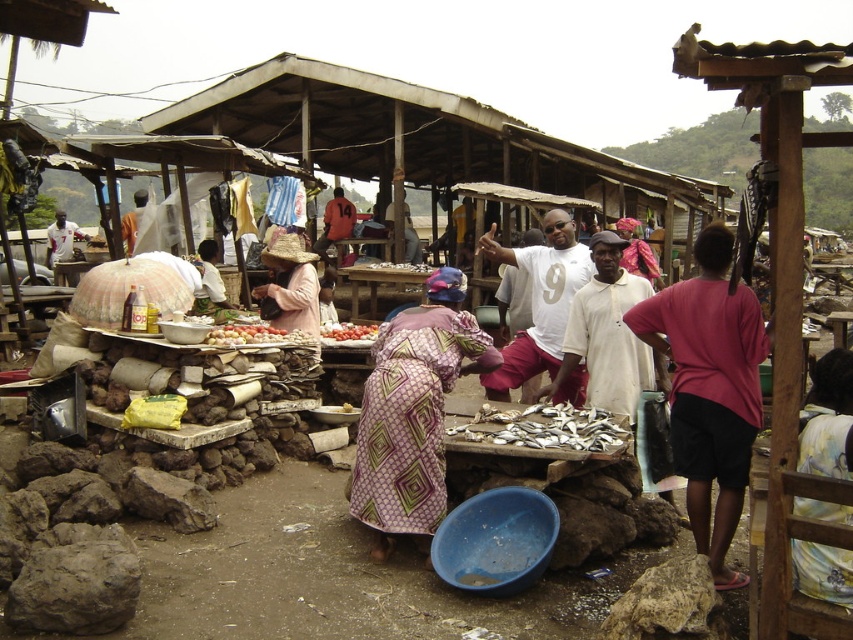
Who is taller, pink fabric shirt at right or purple printed fabric at center?

With more height is pink fabric shirt at right.

Between point (672, 300) and point (456, 294), which one is positioned in front?

Point (672, 300) is in front.

This screenshot has width=853, height=640. What do you see at coordinates (711, 388) in the screenshot?
I see `pink fabric shirt at right` at bounding box center [711, 388].

Locate an element on the screen. Image resolution: width=853 pixels, height=640 pixels. pink fabric shirt at right is located at coordinates (711, 388).

Based on the photo, is silver metallic fish at center shorter than smooth red tomatoes at center?

No.

Can you confirm if silver metallic fish at center is positioned above smooth red tomatoes at center?

Incorrect, silver metallic fish at center is not positioned above smooth red tomatoes at center.

Identify the location of silver metallic fish at center. Image resolution: width=853 pixels, height=640 pixels. (546, 428).

Does purple printed fabric at center appear on the left side of ripe tomato at center?

In fact, purple printed fabric at center is to the right of ripe tomato at center.

Can you confirm if purple printed fabric at center is smaller than ripe tomato at center?

Incorrect, purple printed fabric at center is not smaller in size than ripe tomato at center.

Between point (462, 321) and point (364, 328), which one is positioned in front?

Positioned in front is point (462, 321).

Identify the location of purple printed fabric at center. Image resolution: width=853 pixels, height=640 pixels. (412, 412).